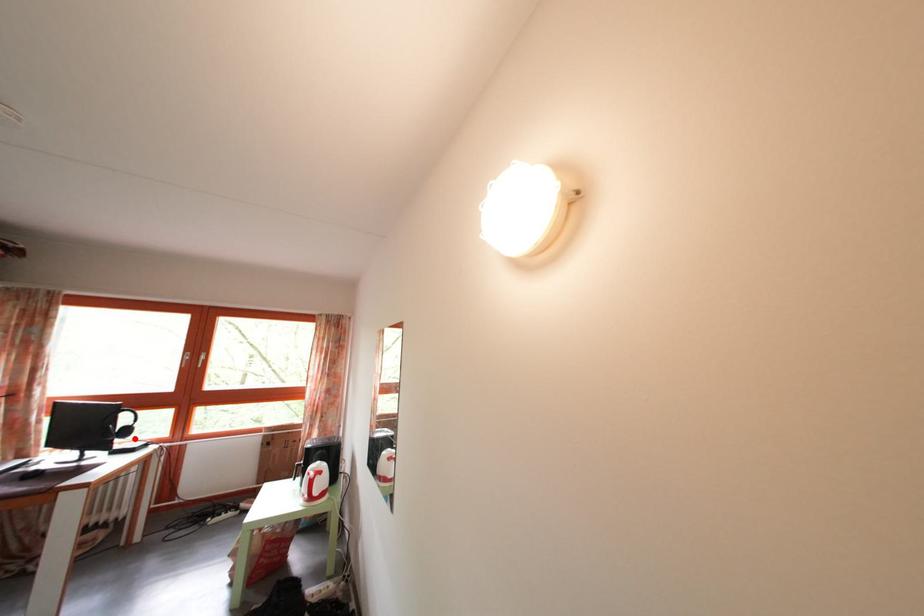
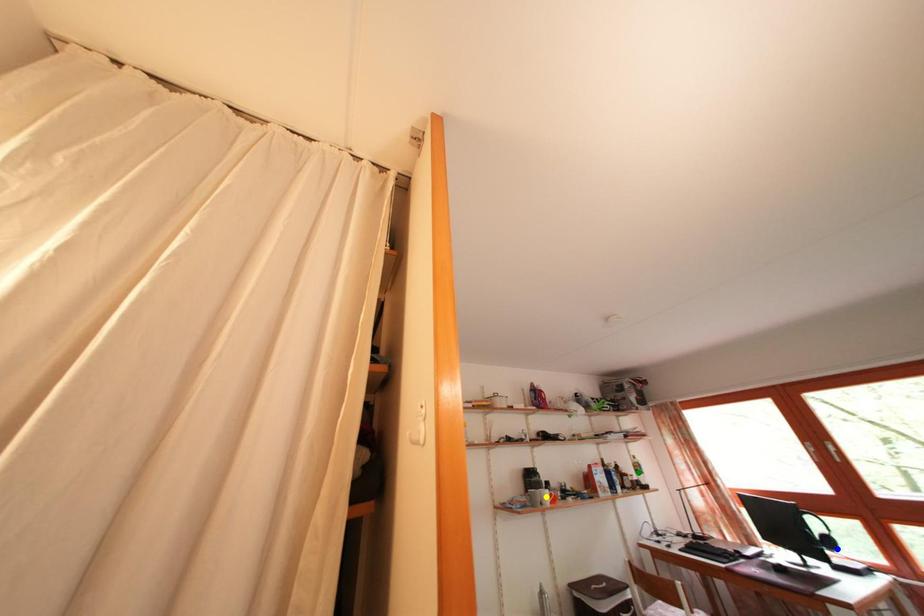
Question: I am providing you with two images of the same scene from different viewpoints. A red point is marked on the first image. You are given multiple points on the second image. Which point in image 2 represents the same 3d spot as the red point in image 1?

Choices:
 (A) green point
 (B) yellow point
 (C) blue point

Answer: (C)